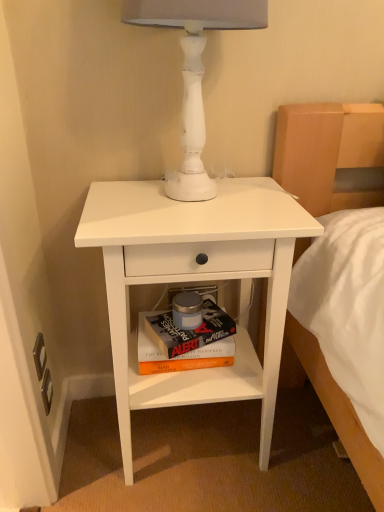
Identify the location of free spot to the right of white matte table lamp at upper center. (272, 197).